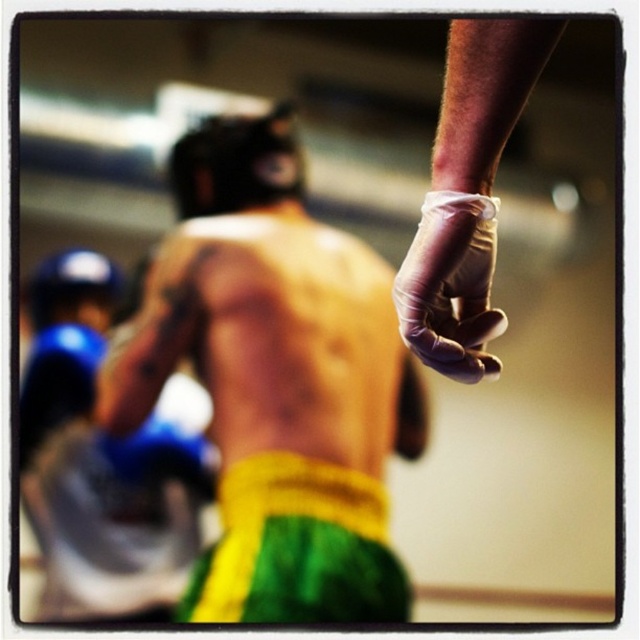
Question: Which object appears closest to the camera in this image?

Choices:
 (A) blue padded gloves at left
 (B) purple latex glove at upper right
 (C) yellow-green shorts at center

Answer: (B)

Question: Which point is closer to the camera?

Choices:
 (A) (468, 195)
 (B) (240, 276)

Answer: (A)

Question: Observing the image, what is the correct spatial positioning of yellow-green shorts at center in reference to purple latex glove at upper right?

Choices:
 (A) above
 (B) below

Answer: (B)

Question: Does blue padded gloves at left appear on the left side of purple latex glove at upper right?

Choices:
 (A) yes
 (B) no

Answer: (A)

Question: Does yellow-green shorts at center have a smaller size compared to purple latex glove at upper right?

Choices:
 (A) no
 (B) yes

Answer: (A)

Question: Which object is farther from the camera taking this photo?

Choices:
 (A) blue padded gloves at left
 (B) yellow-green shorts at center
 (C) purple latex glove at upper right

Answer: (A)